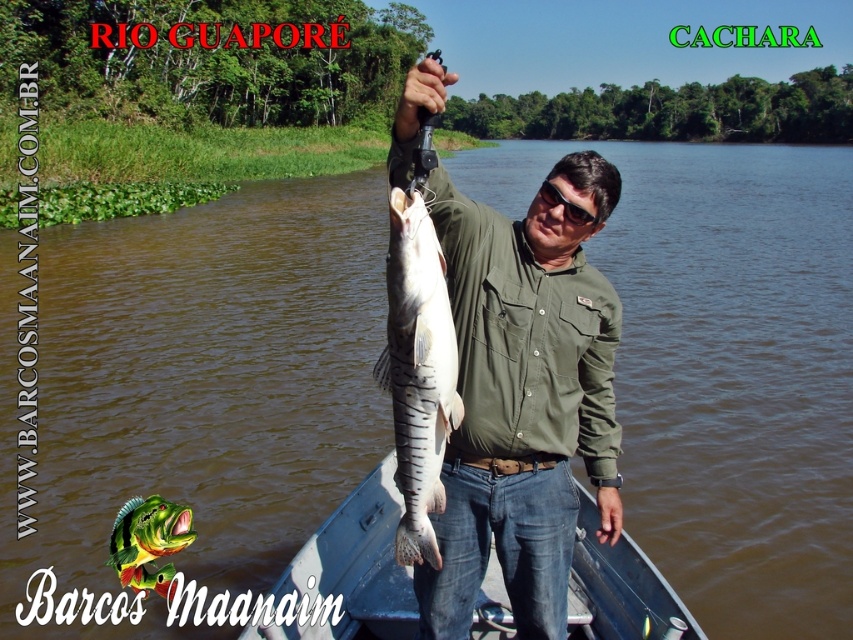
Locate an element on the screen. green matte shirt at center is located at coordinates (524, 396).

Which of these two, green matte shirt at center or blue plastic boat at center, stands shorter?

Standing shorter between the two is green matte shirt at center.

You are a GUI agent. You are given a task and a screenshot of the screen. Output one action in this format:
    pyautogui.click(x=<x>, y=<y>)
    Task: Click on the green matte shirt at center
    This screenshot has width=853, height=640.
    Given the screenshot: What is the action you would take?
    pyautogui.click(x=524, y=396)

Which is more to the right, green matte shirt at center or white striped fish at center?

green matte shirt at center is more to the right.

Is green matte shirt at center further to camera compared to white striped fish at center?

That is True.

Does point (604, 193) lie in front of point (451, 380)?

No, it is not.

Identify the location of green matte shirt at center. The width and height of the screenshot is (853, 640). (524, 396).

Is white striped fish at center closer to the viewer compared to shiny green fish at center?

Yes, white striped fish at center is in front of shiny green fish at center.

Between white striped fish at center and shiny green fish at center, which one has more height?

white striped fish at center is taller.

What are the coordinates of `white striped fish at center` in the screenshot? It's located at tap(418, 371).